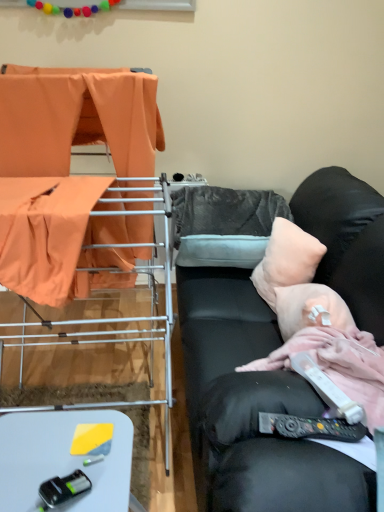
I want to click on free space above white plastic table at lower left (from a real-world perspective), so click(65, 453).